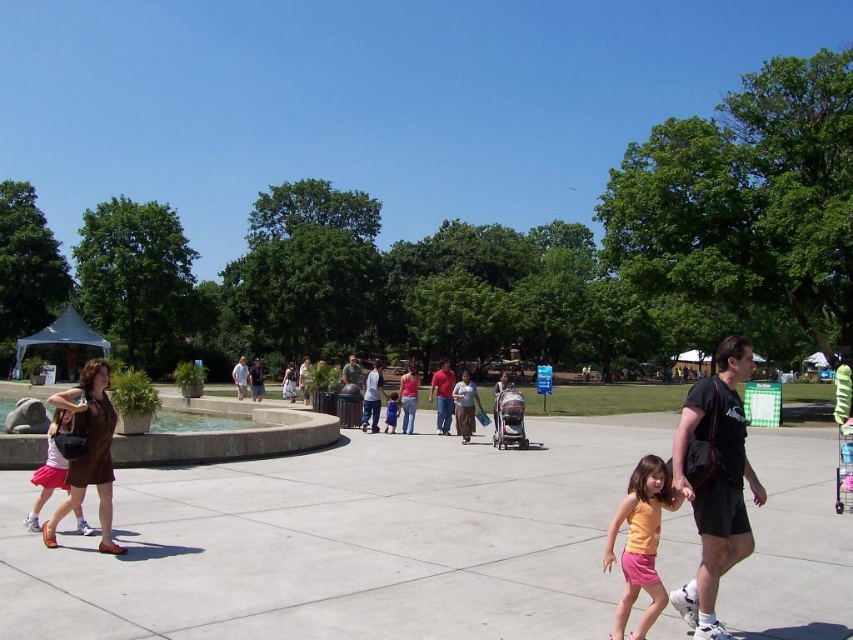
You are a photographer standing in the park and want to capture a photo that includes both the pink matte skirt at lower left and the blue denim shorts at center. Which object should you focus on first to ensure both are in the frame?

The pink matte skirt at lower left is much taller than the blue denim shorts at center, so you should focus on the pink matte skirt at lower left first to ensure both are in the frame.